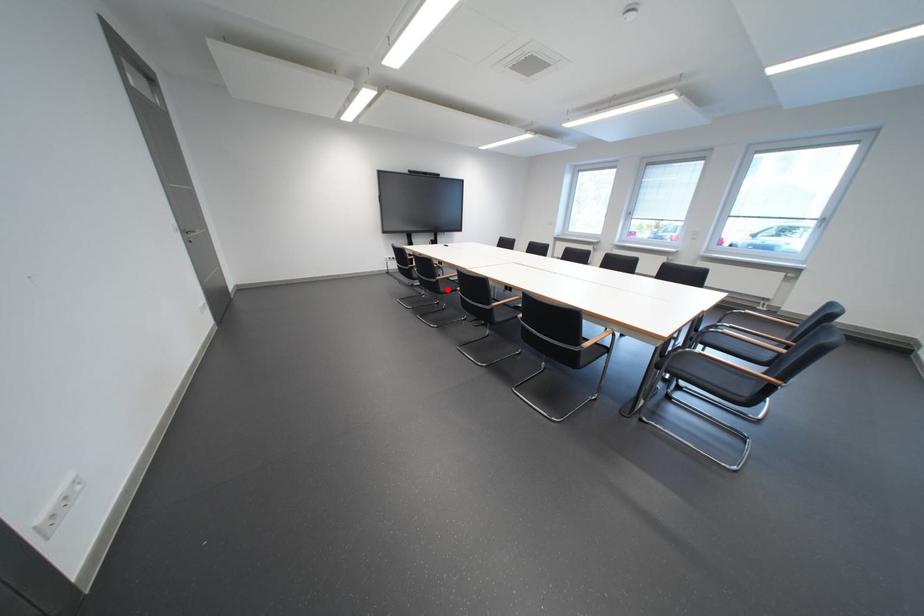
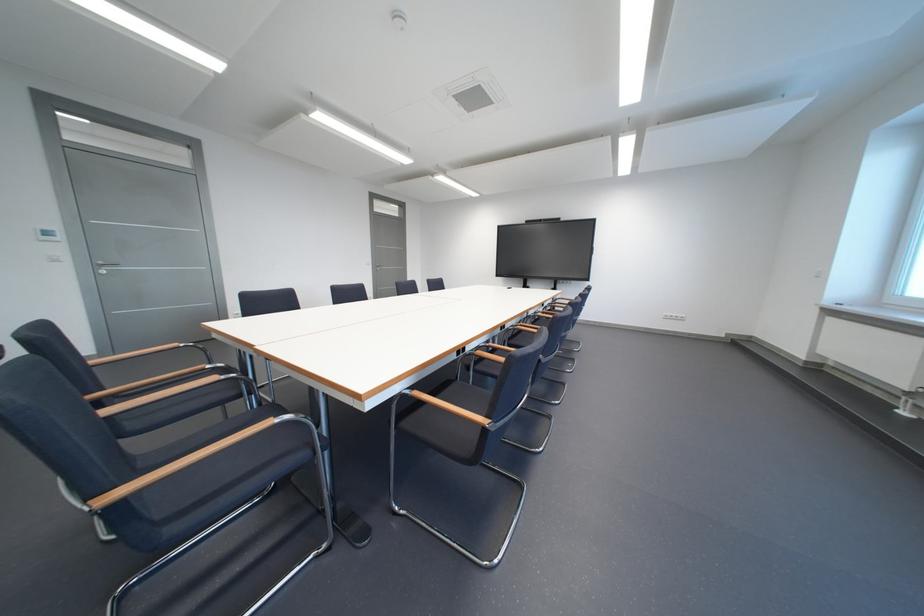
Question: I am providing you with two images of the same scene from different viewpoints. A red point is marked on the first image. At the location where the point appears in image 1, is it still visible in image 2?

Choices:
 (A) Yes
 (B) No

Answer: (B)